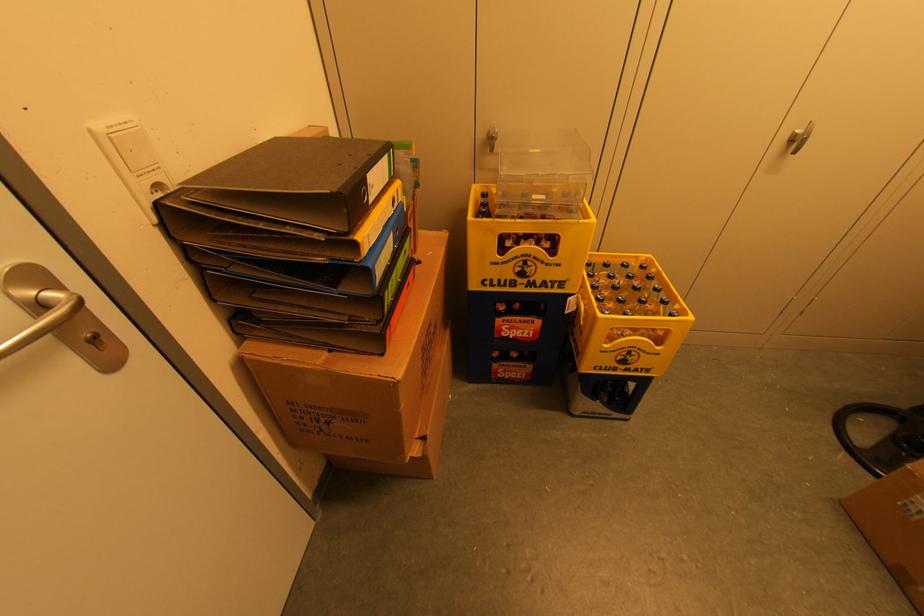
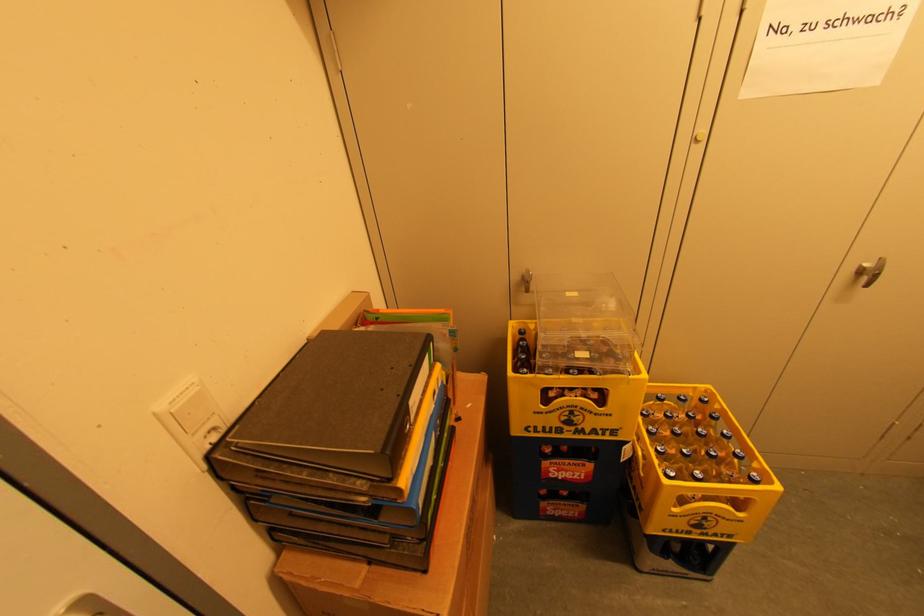
In the second image, find the point that corresponds to (x=311, y=127) in the first image.

(357, 292)